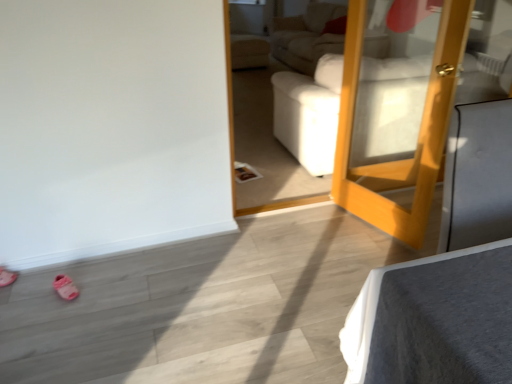
Question: Is pink fabric shoe at lower left, acting as the second shoe starting from the left, facing away from pink rubber shoe at lower left, arranged as the 1th shoe when viewed from the left?

Choices:
 (A) yes
 (B) no

Answer: (B)

Question: Is pink rubber shoe at lower left, arranged as the 1th shoe when viewed from the left, completely or partially inside pink fabric shoe at lower left, which ranks as the first shoe in right-to-left order?

Choices:
 (A) no
 (B) yes

Answer: (A)

Question: From the image's perspective, would you say pink fabric shoe at lower left, acting as the second shoe starting from the left, is positioned over pink rubber shoe at lower left, marked as the second shoe in a right-to-left arrangement?

Choices:
 (A) yes
 (B) no

Answer: (B)

Question: Considering the relative sizes of pink fabric shoe at lower left, which ranks as the first shoe in right-to-left order, and pink rubber shoe at lower left, arranged as the 1th shoe when viewed from the left, in the image provided, is pink fabric shoe at lower left, which ranks as the first shoe in right-to-left order, bigger than pink rubber shoe at lower left, arranged as the 1th shoe when viewed from the left,?

Choices:
 (A) yes
 (B) no

Answer: (B)

Question: Is pink fabric shoe at lower left, which ranks as the first shoe in right-to-left order, placed right next to pink rubber shoe at lower left, arranged as the 1th shoe when viewed from the left?

Choices:
 (A) yes
 (B) no

Answer: (B)

Question: Is pink fabric shoe at lower left, acting as the second shoe starting from the left, in front of or behind wooden mirror at right in the image?

Choices:
 (A) front
 (B) behind

Answer: (B)

Question: In the image, is pink fabric shoe at lower left, which ranks as the first shoe in right-to-left order, on the left side or the right side of wooden mirror at right?

Choices:
 (A) left
 (B) right

Answer: (A)

Question: From a real-world perspective, is pink fabric shoe at lower left, which ranks as the first shoe in right-to-left order, positioned above or below wooden mirror at right?

Choices:
 (A) above
 (B) below

Answer: (B)

Question: In terms of width, does pink fabric shoe at lower left, which ranks as the first shoe in right-to-left order, look wider or thinner when compared to wooden mirror at right?

Choices:
 (A) thin
 (B) wide

Answer: (B)

Question: Does point (62, 294) appear closer or farther from the camera than point (1, 278)?

Choices:
 (A) farther
 (B) closer

Answer: (B)

Question: Is pink fabric shoe at lower left, which ranks as the first shoe in right-to-left order, in front of or behind pink rubber shoe at lower left, marked as the second shoe in a right-to-left arrangement, in the image?

Choices:
 (A) front
 (B) behind

Answer: (A)

Question: From a real-world perspective, is pink fabric shoe at lower left, which ranks as the first shoe in right-to-left order, above or below pink rubber shoe at lower left, marked as the second shoe in a right-to-left arrangement?

Choices:
 (A) above
 (B) below

Answer: (A)

Question: Is pink fabric shoe at lower left, which ranks as the first shoe in right-to-left order, bigger or smaller than pink rubber shoe at lower left, arranged as the 1th shoe when viewed from the left?

Choices:
 (A) small
 (B) big

Answer: (A)

Question: Is pink rubber shoe at lower left, arranged as the 1th shoe when viewed from the left, to the left or to the right of wooden mirror at right in the image?

Choices:
 (A) left
 (B) right

Answer: (A)

Question: Considering the positions of pink rubber shoe at lower left, arranged as the 1th shoe when viewed from the left, and wooden mirror at right in the image, is pink rubber shoe at lower left, arranged as the 1th shoe when viewed from the left, bigger or smaller than wooden mirror at right?

Choices:
 (A) small
 (B) big

Answer: (A)